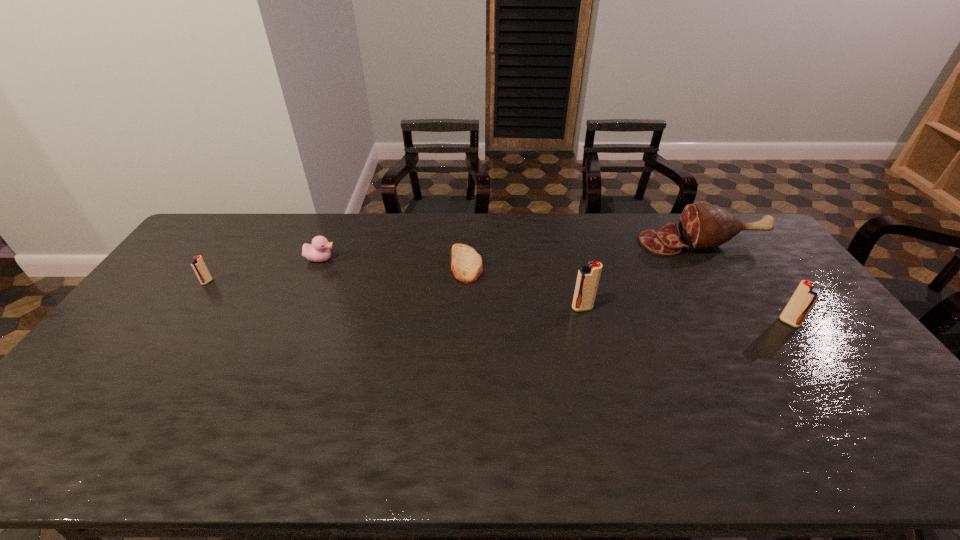
Locate an element on the screen. igniter that is the closest to the ham is located at coordinates (805, 296).

Where is `free location that satisfies the following two spatial constraints: 1. at the sliced end of the ham; 2. on the front side of the second igniter from left to right`? This screenshot has height=540, width=960. free location that satisfies the following two spatial constraints: 1. at the sliced end of the ham; 2. on the front side of the second igniter from left to right is located at coordinates (743, 308).

Locate an element on the screen. The height and width of the screenshot is (540, 960). vacant region that satisfies the following two spatial constraints: 1. on the front-facing side of the second tallest igniter; 2. on the right side of the second object from left to right is located at coordinates (294, 322).

The image size is (960, 540). In order to click on vacant space that satisfies the following two spatial constraints: 1. on the front-facing side of the second igniter from left to right; 2. on the right side of the fifth object from right to left in this screenshot , I will do `click(300, 308)`.

Where is `vacant region that satisfies the following two spatial constraints: 1. on the front-facing side of the fifth object from right to left; 2. on the left side of the second nearest igniter`? This screenshot has width=960, height=540. vacant region that satisfies the following two spatial constraints: 1. on the front-facing side of the fifth object from right to left; 2. on the left side of the second nearest igniter is located at coordinates (300, 308).

The image size is (960, 540). Identify the location of free space that satisfies the following two spatial constraints: 1. at the sliced end of the ham; 2. on the front side of the leftmost igniter. (727, 282).